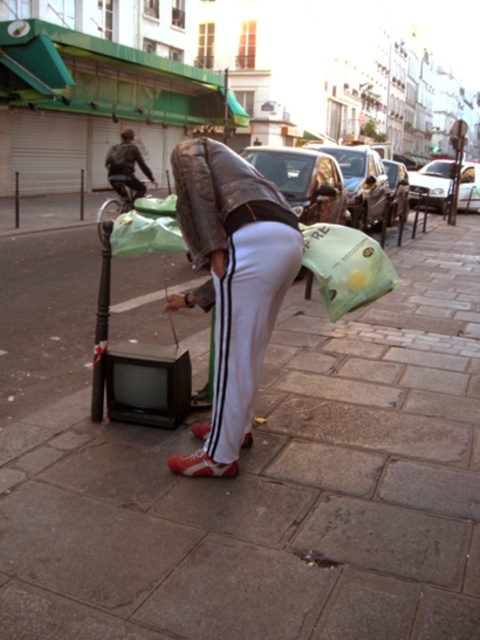
Looking at this image, you are a delivery person who needs to place a package on the gray concrete pavement at center. However, there is a leather jacket at center in the way. Can you move the jacket to access the pavement?

The gray concrete pavement at center is below the leather jacket at center, so you can move the leather jacket at center to access the gray concrete pavement at center.

You are a delivery person trying to place a package on the gray concrete pavement at center and the leather jacket at center. Which object should you avoid placing the package on?

You should avoid placing the package on the leather jacket at center because the gray concrete pavement at center is positioned on the left side of it, and the jacket is likely being worn by the person examining the TV, so placing the package there would be obstructive.